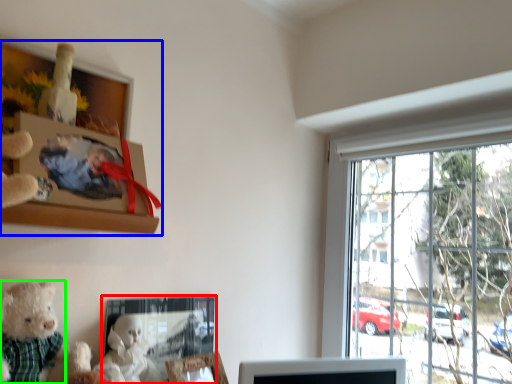
Question: Based on their relative distances, which object is nearer to picture frame (highlighted by a red box)? Choose from picture frame (highlighted by a blue box) and teddy bear (highlighted by a green box).

Choices:
 (A) picture frame
 (B) teddy bear

Answer: (B)